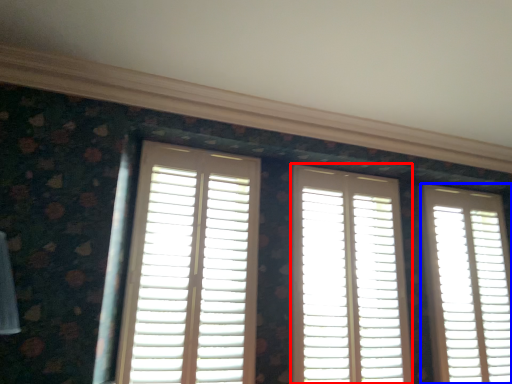
Question: Which object is closer to the camera taking this photo, window (highlighted by a red box) or window (highlighted by a blue box)?

Choices:
 (A) window
 (B) window

Answer: (A)